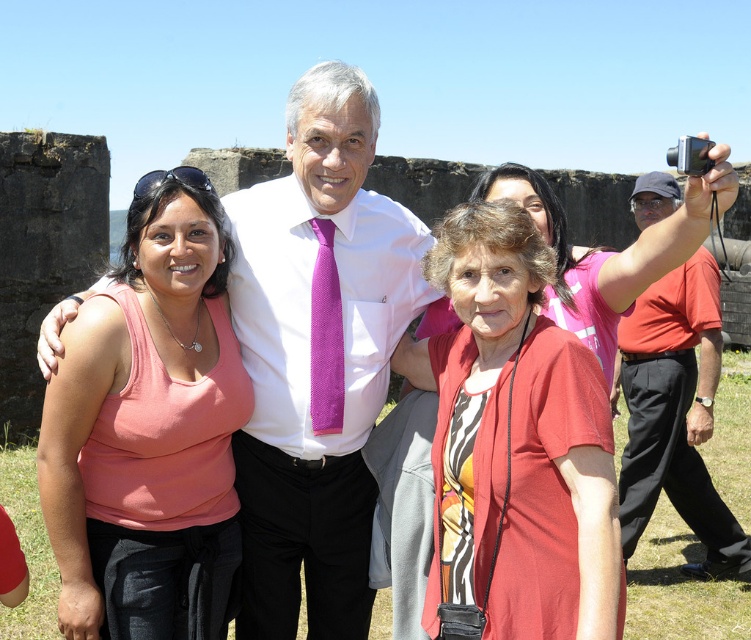
You are a photographer at the event and want to capture a photo that includes both the matte red shirt at center and the orange cotton shirt at right. Which shirt should you position to the left side of your frame to ensure both are in the shot?

You should position the matte red shirt at center on the left side of your frame since it is already to the left of the orange cotton shirt at right in the scene.